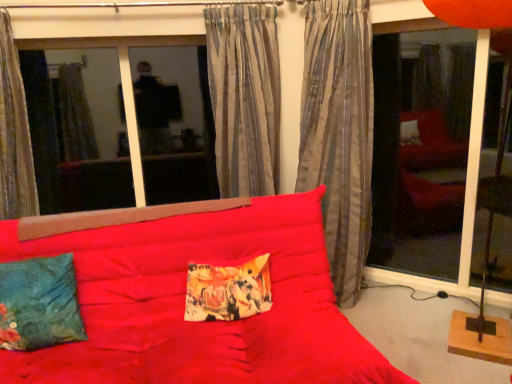
Measure the distance between printed fabric pillow at center, which is counted as the 2th pillow, starting from the left, and camera.

printed fabric pillow at center, which is counted as the 2th pillow, starting from the left, and camera are 6.63 feet apart from each other.

Locate an element on the screen. The image size is (512, 384). striped fabric curtain at left, the 1th curtain when ordered from left to right is located at coordinates pos(14,134).

How much space does striped fabric curtain at left, which appears as the 3th curtain when viewed from the right, occupy vertically?

striped fabric curtain at left, which appears as the 3th curtain when viewed from the right, is 3.94 feet tall.

Describe the element at coordinates (39, 304) in the screenshot. I see `velvety teal pillow at lower left, which appears as the first pillow when viewed from the left` at that location.

Where is `silky gray curtain at center, positioned as the first curtain in right-to-left order`? The height and width of the screenshot is (384, 512). silky gray curtain at center, positioned as the first curtain in right-to-left order is located at coordinates (339, 133).

This screenshot has width=512, height=384. What do you see at coordinates (184, 303) in the screenshot?
I see `matte red studio couch at center` at bounding box center [184, 303].

This screenshot has width=512, height=384. What are the coordinates of `transparent glass window at upper left` in the screenshot? It's located at (141, 129).

Measure the distance between point (204, 71) and camera.

Point (204, 71) and camera are 2.98 meters apart from each other.

The height and width of the screenshot is (384, 512). Describe the element at coordinates (421, 149) in the screenshot. I see `transparent glass door at right` at that location.

What is the approximate width of transparent glass door at right?

transparent glass door at right is 12.03 centimeters in width.

This screenshot has height=384, width=512. In order to click on printed fabric pillow at center, acting as the 1th pillow starting from the right in this screenshot , I will do `click(228, 289)`.

This screenshot has height=384, width=512. In the image, there is a transparent glass door at right. Identify the location of studio couch below it (from the image's perspective). (184, 303).

Between transparent glass door at right and matte red studio couch at center, which one has smaller size?

Smaller between the two is transparent glass door at right.

Which object is positioned more to the right, transparent glass door at right or matte red studio couch at center?

transparent glass door at right is more to the right.

Is striped fabric curtain at center, which is counted as the 2th curtain, starting from the left, facing towards velvety teal pillow at lower left, which appears as the first pillow when viewed from the left?

No, striped fabric curtain at center, which is counted as the 2th curtain, starting from the left, is not aimed at velvety teal pillow at lower left, which appears as the first pillow when viewed from the left.

Between point (277, 121) and point (26, 300), which one is positioned in front?

The point (26, 300) is more forward.

Based on their positions, is striped fabric curtain at center, the second curtain from the right, located to the left or right of velvety teal pillow at lower left, which appears as the first pillow when viewed from the left?

From the image, it's evident that striped fabric curtain at center, the second curtain from the right, is to the right of velvety teal pillow at lower left, which appears as the first pillow when viewed from the left.

Which of these two, transparent glass window at upper left or printed fabric pillow at center, which is counted as the 2th pillow, starting from the left, stands taller?

Standing taller between the two is transparent glass window at upper left.

From the image's perspective, between transparent glass window at upper left and printed fabric pillow at center, which is counted as the 2th pillow, starting from the left, which one is located above?

transparent glass window at upper left, from the image's perspective.

Considering the relative sizes of transparent glass window at upper left and printed fabric pillow at center, acting as the 1th pillow starting from the right, in the image provided, is transparent glass window at upper left bigger than printed fabric pillow at center, acting as the 1th pillow starting from the right,?

Yes, transparent glass window at upper left is bigger than printed fabric pillow at center, acting as the 1th pillow starting from the right.

The height and width of the screenshot is (384, 512). Identify the location of window screen on the left of printed fabric pillow at center, acting as the 1th pillow starting from the right. (141, 129).

Which is in front, point (257, 254) or point (337, 150)?

Positioned in front is point (257, 254).

Could silky gray curtain at center, positioned as the 3th curtain in left-to-right order, be considered to be inside matte red studio couch at center?

No, silky gray curtain at center, positioned as the 3th curtain in left-to-right order, is not a part of matte red studio couch at center.

From the image's perspective, between matte red studio couch at center and silky gray curtain at center, positioned as the first curtain in right-to-left order, which one is located above?

silky gray curtain at center, positioned as the first curtain in right-to-left order.

Are printed fabric pillow at center, acting as the 1th pillow starting from the right, and transparent glass window at upper left far apart?

Yes.

Is printed fabric pillow at center, acting as the 1th pillow starting from the right, to the right of transparent glass window at upper left from the viewer's perspective?

Correct, you'll find printed fabric pillow at center, acting as the 1th pillow starting from the right, to the right of transparent glass window at upper left.

Between printed fabric pillow at center, which is counted as the 2th pillow, starting from the left, and transparent glass window at upper left, which one has larger width?

printed fabric pillow at center, which is counted as the 2th pillow, starting from the left.

How different are the orientations of printed fabric pillow at center, acting as the 1th pillow starting from the right, and transparent glass window at upper left in degrees?

The facing directions of printed fabric pillow at center, acting as the 1th pillow starting from the right, and transparent glass window at upper left are 2.71 degrees apart.

Could velvety teal pillow at lower left, which appears as the first pillow when viewed from the left, be considered to be inside striped fabric curtain at left, the 1th curtain when ordered from left to right?

No, velvety teal pillow at lower left, which appears as the first pillow when viewed from the left, is not a part of striped fabric curtain at left, the 1th curtain when ordered from left to right.

Is velvety teal pillow at lower left, which appears as the first pillow when viewed from the left, at the back of striped fabric curtain at left, which appears as the 3th curtain when viewed from the right?

That's not correct — striped fabric curtain at left, which appears as the 3th curtain when viewed from the right, is not looking away from velvety teal pillow at lower left, which appears as the first pillow when viewed from the left.

From the image's perspective, between striped fabric curtain at left, which appears as the 3th curtain when viewed from the right, and velvety teal pillow at lower left, the 2th pillow positioned from the right, who is located below?

From the image's view, velvety teal pillow at lower left, the 2th pillow positioned from the right, is below.

Who is taller, striped fabric curtain at left, which appears as the 3th curtain when viewed from the right, or velvety teal pillow at lower left, which appears as the first pillow when viewed from the left?

striped fabric curtain at left, which appears as the 3th curtain when viewed from the right.

How many degrees apart are the facing directions of silky gray curtain at center, positioned as the 3th curtain in left-to-right order, and printed fabric pillow at center, acting as the 1th pillow starting from the right?

The angle between the facing direction of silky gray curtain at center, positioned as the 3th curtain in left-to-right order, and the facing direction of printed fabric pillow at center, acting as the 1th pillow starting from the right, is 41.6 degrees.

In the scene shown: Is silky gray curtain at center, positioned as the first curtain in right-to-left order, oriented towards printed fabric pillow at center, which is counted as the 2th pillow, starting from the left?

Yes, silky gray curtain at center, positioned as the first curtain in right-to-left order, is oriented towards printed fabric pillow at center, which is counted as the 2th pillow, starting from the left.

Considering the sizes of objects silky gray curtain at center, positioned as the first curtain in right-to-left order, and printed fabric pillow at center, which is counted as the 2th pillow, starting from the left, in the image provided, who is smaller, silky gray curtain at center, positioned as the first curtain in right-to-left order, or printed fabric pillow at center, which is counted as the 2th pillow, starting from the left,?

Smaller between the two is printed fabric pillow at center, which is counted as the 2th pillow, starting from the left.

Is silky gray curtain at center, positioned as the 3th curtain in left-to-right order, to the left of printed fabric pillow at center, which is counted as the 2th pillow, starting from the left, from the viewer's perspective?

No.

This screenshot has height=384, width=512. I want to click on studio couch on the left of transparent glass door at right, so click(x=184, y=303).

This screenshot has height=384, width=512. Identify the location of curtain that is the 3rd one when counting upward from the velvety teal pillow at lower left, which appears as the first pillow when viewed from the left (from the image's perspective). (244, 97).

Looking at the image, which one is located closer to silky gray curtain at center, positioned as the first curtain in right-to-left order, matte red studio couch at center or transparent glass door at right?

matte red studio couch at center is closer to silky gray curtain at center, positioned as the first curtain in right-to-left order.

Estimate the real-world distances between objects in this image. Which object is closer to matte red studio couch at center, striped fabric curtain at center, which is counted as the 2th curtain, starting from the left, or silky gray curtain at center, positioned as the 3th curtain in left-to-right order?

silky gray curtain at center, positioned as the 3th curtain in left-to-right order, is positioned closer to the anchor matte red studio couch at center.

Considering their positions, is transparent glass window at upper left positioned further to printed fabric pillow at center, which is counted as the 2th pillow, starting from the left, than striped fabric curtain at left, which appears as the 3th curtain when viewed from the right?

transparent glass window at upper left.

Based on their spatial positions, is transparent glass window at upper left or transparent glass door at right closer to matte red studio couch at center?

Based on the image, transparent glass door at right appears to be nearer to matte red studio couch at center.

Looking at the image, which one is located further to transparent glass door at right, transparent glass window at upper left or printed fabric pillow at center, which is counted as the 2th pillow, starting from the left?

Based on the image, transparent glass window at upper left appears to be further to transparent glass door at right.

Which object lies nearer to the anchor point striped fabric curtain at center, which is counted as the 2th curtain, starting from the left, transparent glass window at upper left or printed fabric pillow at center, which is counted as the 2th pillow, starting from the left?

Among the two, printed fabric pillow at center, which is counted as the 2th pillow, starting from the left, is located nearer to striped fabric curtain at center, which is counted as the 2th curtain, starting from the left.

Based on the photo, considering their positions, is striped fabric curtain at left, the 1th curtain when ordered from left to right, positioned closer to transparent glass door at right than silky gray curtain at center, positioned as the first curtain in right-to-left order?

Among the two, silky gray curtain at center, positioned as the first curtain in right-to-left order, is located nearer to transparent glass door at right.

When comparing their distances from velvety teal pillow at lower left, the 2th pillow positioned from the right, does matte red studio couch at center or striped fabric curtain at center, the second curtain from the right, seem further?

striped fabric curtain at center, the second curtain from the right.

Locate an element on the screen. This screenshot has height=384, width=512. pillow between velvety teal pillow at lower left, the 2th pillow positioned from the right, and silky gray curtain at center, positioned as the 3th curtain in left-to-right order is located at coordinates (228, 289).

The image size is (512, 384). In order to click on studio couch between velvety teal pillow at lower left, which appears as the first pillow when viewed from the left, and silky gray curtain at center, positioned as the 3th curtain in left-to-right order in this screenshot , I will do `click(184, 303)`.

What are the coordinates of `pillow between transparent glass window at upper left and silky gray curtain at center, positioned as the 3th curtain in left-to-right order, in the horizontal direction` in the screenshot? It's located at (228, 289).

Image resolution: width=512 pixels, height=384 pixels. Identify the location of window screen between striped fabric curtain at left, the 1th curtain when ordered from left to right, and transparent glass door at right from left to right. 141,129.